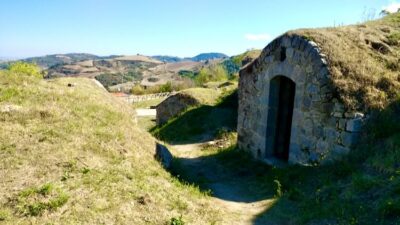
At what (x,y) coordinates should I click in order to perform the action: click on doorway. Please return your answer as a coordinate pair (x, y). This screenshot has height=225, width=400. Looking at the image, I should click on 280,118.